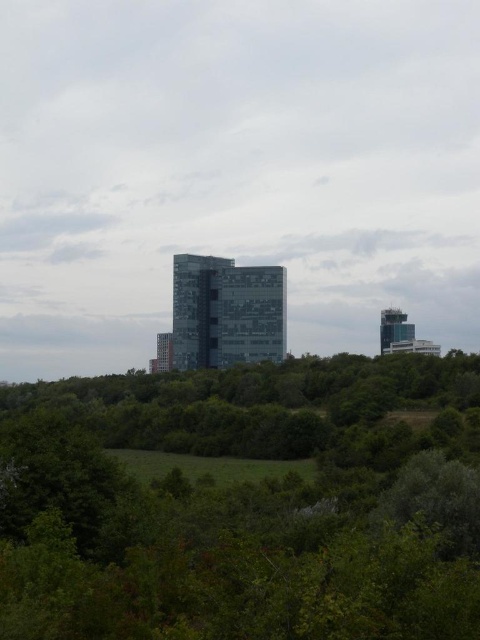
Between green leafy tree at center and glassy reflective tower at right, which one is positioned higher?

glassy reflective tower at right is above.

Consider the image. Does green leafy tree at center have a larger size compared to glassy reflective tower at right?

Yes, green leafy tree at center is bigger than glassy reflective tower at right.

Does point (211, 577) come farther from viewer compared to point (388, 307)?

That is False.

The image size is (480, 640). I want to click on green leafy tree at center, so click(244, 502).

Is glassy reflective building at center above glassy reflective tower at right?

Yes, glassy reflective building at center is above glassy reflective tower at right.

Does glassy reflective building at center have a smaller size compared to glassy reflective tower at right?

No, glassy reflective building at center is not smaller than glassy reflective tower at right.

Identify the location of glassy reflective building at center. Image resolution: width=480 pixels, height=640 pixels. (227, 312).

Is glassy reflective building at center closer to the viewer compared to transparent glass tower at center?

That is True.

Does point (242, 348) lie in front of point (156, 369)?

Yes, point (242, 348) is in front of point (156, 369).

The height and width of the screenshot is (640, 480). Identify the location of glassy reflective building at center. (227, 312).